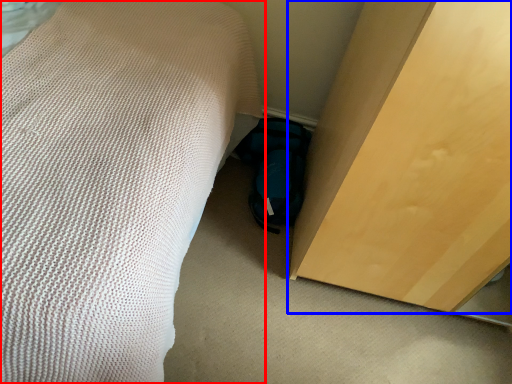
Question: Which object is closer to the camera taking this photo, bed (highlighted by a red box) or furniture (highlighted by a blue box)?

Choices:
 (A) bed
 (B) furniture

Answer: (A)